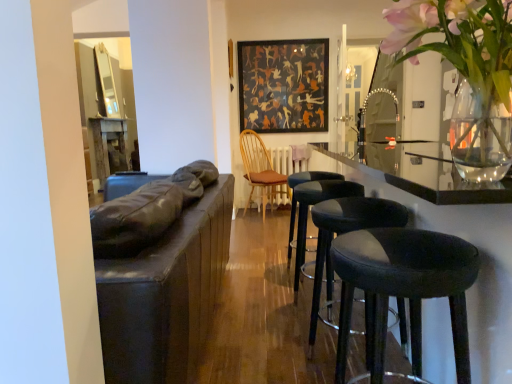
Question: Considering the relative positions of black leather stool at center, the 1th stool in the back-to-front sequence, and black leather bar stools at right in the image provided, is black leather stool at center, the 1th stool in the back-to-front sequence, to the left or to the right of black leather bar stools at right?

Choices:
 (A) left
 (B) right

Answer: (A)

Question: Does point (290, 182) appear closer or farther from the camera than point (441, 345)?

Choices:
 (A) farther
 (B) closer

Answer: (A)

Question: Considering the real-world distances, which object is closest to the black leather stool at center, the 1th stool in the back-to-front sequence?

Choices:
 (A) black leather bar stools at right
 (B) black leather stool at lower right, which is counted as the first stool, starting from the front
 (C) black leather stool at center, marked as the 2th stool in a back-to-front arrangement
 (D) black leather stool at center, which ranks as the third stool in back-to-front order
 (E) wooden spindles chair at center

Answer: (C)

Question: Which object is the closest to the dark matte painting at center?

Choices:
 (A) wooden spindles chair at center
 (B) clear glass vase at upper right
 (C) black leather stool at center, the second stool when ordered from front to back
 (D) black leather stool at center, the fourth stool in the front-to-back sequence
 (E) black leather stool at center, marked as the 2th stool in a back-to-front arrangement

Answer: (A)